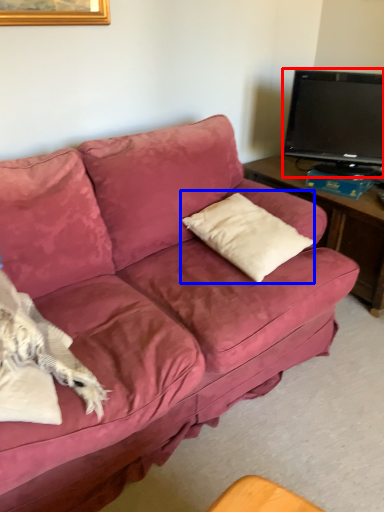
Question: Which object is further to the camera taking this photo, television (highlighted by a red box) or throw pillow (highlighted by a blue box)?

Choices:
 (A) television
 (B) throw pillow

Answer: (A)